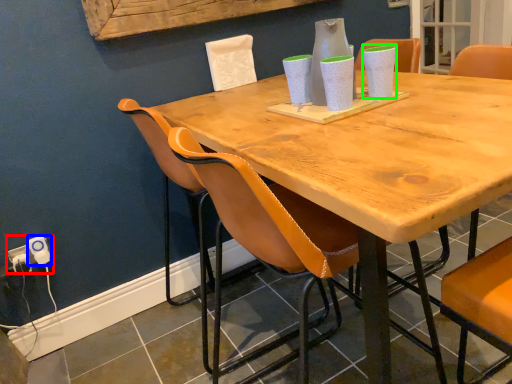
Question: Which object is the closest to the electric outlet (highlighted by a red box)? Choose among these: electric outlet (highlighted by a blue box) or vase (highlighted by a green box).

Choices:
 (A) electric outlet
 (B) vase

Answer: (A)